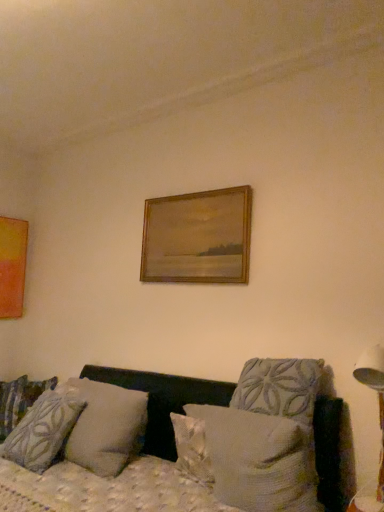
Describe the element at coordinates (105, 426) in the screenshot. I see `textured gray pillow at center, the 2th pillow when ordered from back to front` at that location.

This screenshot has height=512, width=384. What are the coordinates of `patterned fabric pillow at left, positioned as the first pillow in left-to-right order` in the screenshot? It's located at tap(19, 400).

This screenshot has width=384, height=512. In order to click on wooden frame at upper center, acting as the 2th picture frame starting from the back in this screenshot , I will do `click(198, 237)`.

At what (x,y) coordinates should I click in order to perform the action: click on textured beige pillow at center, which ranks as the 1th pillow in right-to-left order. Please return your answer as a coordinate pair (x, y). Looking at the image, I should click on (259, 460).

Can you confirm if wooden frame at upper center, acting as the first picture frame starting from the right, is smaller than patterned fabric pillow at left, positioned as the 4th pillow in front-to-back order?

Yes.

This screenshot has width=384, height=512. Find the location of `the 2nd picture frame directly above the patterned fabric pillow at left, positioned as the first pillow in left-to-right order (from a real-world perspective)`. the 2nd picture frame directly above the patterned fabric pillow at left, positioned as the first pillow in left-to-right order (from a real-world perspective) is located at coordinates (198, 237).

Could you tell me if wooden frame at upper center, acting as the 2th picture frame starting from the back, is turned towards patterned fabric pillow at left, positioned as the 4th pillow in front-to-back order?

No.

From a real-world perspective, between wooden frame at upper center, acting as the 2th picture frame starting from the back, and patterned fabric pillow at left, positioned as the first pillow in left-to-right order, who is vertically lower?

patterned fabric pillow at left, positioned as the first pillow in left-to-right order, is physically lower.

Where is `the 1st pillow counting from the left side of the white plastic table lamp at right`? the 1st pillow counting from the left side of the white plastic table lamp at right is located at coordinates (259, 460).

From the image's perspective, between textured beige pillow at center, which ranks as the 4th pillow in left-to-right order, and white plastic table lamp at right, which one is located above?

From the image's view, white plastic table lamp at right is above.

Which is behind, textured beige pillow at center, which ranks as the 1th pillow in right-to-left order, or white plastic table lamp at right?

white plastic table lamp at right is further from the camera.

Between textured fabric couch at lower center and textured beige pillow at center, which is the 4th pillow in back-to-front order, which one appears on the right side from the viewer's perspective?

textured beige pillow at center, which is the 4th pillow in back-to-front order.

Between textured fabric couch at lower center and textured beige pillow at center, which ranks as the 4th pillow in left-to-right order, which one has larger size?

Bigger between the two is textured fabric couch at lower center.

Does textured fabric couch at lower center turn towards textured beige pillow at center, which ranks as the 1th pillow in right-to-left order?

No, textured fabric couch at lower center does not turn towards textured beige pillow at center, which ranks as the 1th pillow in right-to-left order.

Consider the image. From a real-world perspective, does textured fabric couch at lower center sit lower than textured beige pillow at center, which ranks as the 4th pillow in left-to-right order?

Correct, in the physical world, textured fabric couch at lower center is lower than textured beige pillow at center, which ranks as the 4th pillow in left-to-right order.

From a real-world perspective, count 2nd pillows downward from the wooden frame at upper center, marked as the second picture frame in a left-to-right arrangement, and point to it. Please provide its 2D coordinates.

[(42, 431)]

Is wooden frame at upper center, acting as the 2th picture frame starting from the back, facing towards textured gray pillow at lower left, which is counted as the third pillow, starting from the back?

No, wooden frame at upper center, acting as the 2th picture frame starting from the back, does not turn towards textured gray pillow at lower left, which is counted as the third pillow, starting from the back.

Which point is more distant from viewer, [169,228] or [26,441]?

The point [169,228] is farther from the camera.

Is wooden frame at upper center, acting as the first picture frame starting from the right, thinner than textured gray pillow at lower left, which is counted as the third pillow, starting from the back?

Yes, wooden frame at upper center, acting as the first picture frame starting from the right, is thinner than textured gray pillow at lower left, which is counted as the third pillow, starting from the back.

Considering the sizes of objects matte orange picture frame at left, acting as the 2th picture frame starting from the front, and textured fabric couch at lower center in the image provided, who is wider, matte orange picture frame at left, acting as the 2th picture frame starting from the front, or textured fabric couch at lower center?

Wider between the two is textured fabric couch at lower center.

Considering the points (6, 302) and (177, 383), which point is behind, point (6, 302) or point (177, 383)?

The point (6, 302) is farther.

Looking at the image, does matte orange picture frame at left, positioned as the 1th picture frame in back-to-front order, seem bigger or smaller compared to textured fabric couch at lower center?

Considering their sizes, matte orange picture frame at left, positioned as the 1th picture frame in back-to-front order, takes up less space than textured fabric couch at lower center.

Between textured beige pillow at center, the first pillow from the front, and textured gray pillow at lower left, placed as the 2th pillow when sorted from left to right, which one has larger width?

textured gray pillow at lower left, placed as the 2th pillow when sorted from left to right, is wider.

From the image's perspective, between textured beige pillow at center, which ranks as the 1th pillow in right-to-left order, and textured gray pillow at lower left, the third pillow from the right, which one is located above?

From the image's view, textured beige pillow at center, which ranks as the 1th pillow in right-to-left order, is above.

Is textured beige pillow at center, which is the 4th pillow in back-to-front order, bigger or smaller than textured gray pillow at lower left, placed as the 2th pillow when sorted from left to right?

Considering their sizes, textured beige pillow at center, which is the 4th pillow in back-to-front order, takes up less space than textured gray pillow at lower left, placed as the 2th pillow when sorted from left to right.

Which is in front, point (228, 452) or point (70, 421)?

The point (228, 452) is in front.

Between textured gray pillow at lower left, placed as the 2th pillow when sorted from left to right, and wooden frame at upper center, the first picture frame when ordered from front to back, which one is positioned behind?

wooden frame at upper center, the first picture frame when ordered from front to back, is further from the camera.

Considering the points (34, 446) and (240, 218), which point is behind, point (34, 446) or point (240, 218)?

The point (240, 218) is farther from the camera.

From a real-world perspective, is textured gray pillow at lower left, the third pillow from the right, on wooden frame at upper center, acting as the 2th picture frame starting from the back?

No, from a real-world perspective, textured gray pillow at lower left, the third pillow from the right, is not over wooden frame at upper center, acting as the 2th picture frame starting from the back

Considering the sizes of textured gray pillow at lower left, which is counted as the third pillow, starting from the back, and wooden frame at upper center, the first picture frame when ordered from front to back, in the image, is textured gray pillow at lower left, which is counted as the third pillow, starting from the back, wider or thinner than wooden frame at upper center, the first picture frame when ordered from front to back,?

textured gray pillow at lower left, which is counted as the third pillow, starting from the back, is wider than wooden frame at upper center, the first picture frame when ordered from front to back.

From a real-world perspective, count 4th pillows downward from the wooden frame at upper center, acting as the 2th picture frame starting from the back, and point to it. Please provide its 2D coordinates.

[(19, 400)]

Which pillow is the 1st one when counting from the left side of the white plastic table lamp at right? Please provide its 2D coordinates.

[(259, 460)]

Estimate the real-world distances between objects in this image. Which object is closer to patterned fabric pillow at left, which is the 1th pillow from back to front, matte orange picture frame at left, which appears as the 1th picture frame when viewed from the left, or white plastic table lamp at right?

Based on the image, matte orange picture frame at left, which appears as the 1th picture frame when viewed from the left, appears to be nearer to patterned fabric pillow at left, which is the 1th pillow from back to front.

When comparing their distances from textured gray pillow at lower left, the second pillow viewed from the front, does textured fabric couch at lower center or textured beige pillow at center, which ranks as the 4th pillow in left-to-right order, seem further?

textured beige pillow at center, which ranks as the 4th pillow in left-to-right order, lies further to textured gray pillow at lower left, the second pillow viewed from the front, than the other object.

Estimate the real-world distances between objects in this image. Which object is closer to textured beige pillow at center, which ranks as the 4th pillow in left-to-right order, wooden frame at upper center, marked as the second picture frame in a left-to-right arrangement, or textured gray pillow at center, marked as the 2th pillow in a right-to-left arrangement?

textured gray pillow at center, marked as the 2th pillow in a right-to-left arrangement, is closer to textured beige pillow at center, which ranks as the 4th pillow in left-to-right order.

Looking at the image, which one is located further to textured gray pillow at lower left, the third pillow from the right, textured fabric couch at lower center or matte orange picture frame at left, which appears as the 1th picture frame when viewed from the left?

Based on the image, matte orange picture frame at left, which appears as the 1th picture frame when viewed from the left, appears to be further to textured gray pillow at lower left, the third pillow from the right.

Based on their spatial positions, is textured fabric couch at lower center or white plastic table lamp at right closer to matte orange picture frame at left, acting as the 2th picture frame starting from the front?

textured fabric couch at lower center is positioned closer to the anchor matte orange picture frame at left, acting as the 2th picture frame starting from the front.

Estimate the real-world distances between objects in this image. Which object is further from white plastic table lamp at right, patterned fabric pillow at left, which ranks as the 4th pillow in right-to-left order, or textured gray pillow at center, the 2th pillow when ordered from back to front?

The object further to white plastic table lamp at right is patterned fabric pillow at left, which ranks as the 4th pillow in right-to-left order.

Looking at the image, which one is located further to matte orange picture frame at left, which appears as the 1th picture frame when viewed from the left, textured gray pillow at center, marked as the 2th pillow in a right-to-left arrangement, or wooden frame at upper center, acting as the first picture frame starting from the right?

wooden frame at upper center, acting as the first picture frame starting from the right, is positioned further to the anchor matte orange picture frame at left, which appears as the 1th picture frame when viewed from the left.

Considering their positions, is textured gray pillow at lower left, the second pillow viewed from the front, positioned further to patterned fabric pillow at left, which ranks as the 4th pillow in right-to-left order, than textured beige pillow at center, which ranks as the 4th pillow in left-to-right order?

textured beige pillow at center, which ranks as the 4th pillow in left-to-right order.

Where is `picture frame between textured gray pillow at center, marked as the 3th pillow in a front-to-back arrangement, and white plastic table lamp at right from left to right`? This screenshot has height=512, width=384. picture frame between textured gray pillow at center, marked as the 3th pillow in a front-to-back arrangement, and white plastic table lamp at right from left to right is located at coordinates (198, 237).

The height and width of the screenshot is (512, 384). Find the location of `picture frame between textured gray pillow at lower left, the third pillow from the right, and white plastic table lamp at right`. picture frame between textured gray pillow at lower left, the third pillow from the right, and white plastic table lamp at right is located at coordinates pos(198,237).

At what (x,y) coordinates should I click in order to perform the action: click on picture frame situated between matte orange picture frame at left, positioned as the 1th picture frame in back-to-front order, and textured beige pillow at center, the first pillow from the front, from left to right. Please return your answer as a coordinate pair (x, y). Looking at the image, I should click on (198, 237).

Where is `studio couch located between textured gray pillow at lower left, placed as the 2th pillow when sorted from left to right, and white plastic table lamp at right in the left-right direction`? Image resolution: width=384 pixels, height=512 pixels. studio couch located between textured gray pillow at lower left, placed as the 2th pillow when sorted from left to right, and white plastic table lamp at right in the left-right direction is located at coordinates (163, 400).